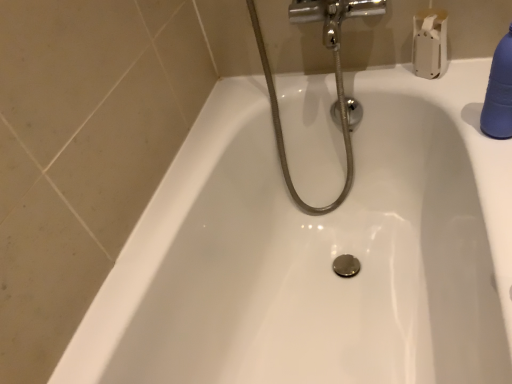
Locate an element on the screen. This screenshot has width=512, height=384. blue rubber bottle at upper right is located at coordinates (499, 92).

I want to click on chrome metallic showerhead at upper center, so click(335, 75).

Can you see blue rubber bottle at upper right touching white matte toilet paper at upper right?

No, blue rubber bottle at upper right is not next to white matte toilet paper at upper right.

Is the depth of blue rubber bottle at upper right greater than that of white matte toilet paper at upper right?

No, blue rubber bottle at upper right is closer to the viewer.

Can you confirm if blue rubber bottle at upper right is bigger than white matte toilet paper at upper right?

Actually, blue rubber bottle at upper right might be smaller than white matte toilet paper at upper right.

Is blue rubber bottle at upper right to the right of white matte toilet paper at upper right from the viewer's perspective?

Indeed, blue rubber bottle at upper right is positioned on the right side of white matte toilet paper at upper right.

Which is behind, white matte toilet paper at upper right or blue rubber bottle at upper right?

Positioned behind is white matte toilet paper at upper right.

Visually, is white matte toilet paper at upper right positioned to the left or to the right of blue rubber bottle at upper right?

white matte toilet paper at upper right is positioned on blue rubber bottle at upper right's left side.

Between white matte toilet paper at upper right and blue rubber bottle at upper right, which one has smaller width?

Thinner between the two is blue rubber bottle at upper right.

Are white matte toilet paper at upper right and blue rubber bottle at upper right located far from each other?

No.

From a real-world perspective, is chrome metallic showerhead at upper center on blue rubber bottle at upper right?

No, from a real-world perspective, chrome metallic showerhead at upper center is not above blue rubber bottle at upper right.

Would you say chrome metallic showerhead at upper center is inside or outside blue rubber bottle at upper right?

chrome metallic showerhead at upper center is not enclosed by blue rubber bottle at upper right.

Considering the relative positions of chrome metallic showerhead at upper center and blue rubber bottle at upper right in the image provided, is chrome metallic showerhead at upper center to the left or to the right of blue rubber bottle at upper right?

Clearly, chrome metallic showerhead at upper center is on the left of blue rubber bottle at upper right in the image.

Considering the sizes of chrome metallic showerhead at upper center and blue rubber bottle at upper right in the image, is chrome metallic showerhead at upper center wider or thinner than blue rubber bottle at upper right?

chrome metallic showerhead at upper center is wider than blue rubber bottle at upper right.

From the image's perspective, does white matte toilet paper at upper right appear higher than chrome metallic showerhead at upper center?

Yes.

How much distance is there between white matte toilet paper at upper right and chrome metallic showerhead at upper center?

The distance of white matte toilet paper at upper right from chrome metallic showerhead at upper center is 9.16 inches.

Can you confirm if white matte toilet paper at upper right is bigger than chrome metallic showerhead at upper center?

Incorrect, white matte toilet paper at upper right is not larger than chrome metallic showerhead at upper center.

Considering the relative sizes of blue rubber bottle at upper right and chrome metallic showerhead at upper center in the image provided, is blue rubber bottle at upper right thinner than chrome metallic showerhead at upper center?

Indeed, blue rubber bottle at upper right has a lesser width compared to chrome metallic showerhead at upper center.

Would you consider blue rubber bottle at upper right to be distant from chrome metallic showerhead at upper center?

No, there isn't a large distance between blue rubber bottle at upper right and chrome metallic showerhead at upper center.

In the image, is blue rubber bottle at upper right positioned in front of or behind chrome metallic showerhead at upper center?

blue rubber bottle at upper right is positioned closer to the viewer than chrome metallic showerhead at upper center.

Is chrome metallic showerhead at upper center located outside white matte toilet paper at upper right?

chrome metallic showerhead at upper center is positioned outside white matte toilet paper at upper right.

Is chrome metallic showerhead at upper center directly adjacent to white matte toilet paper at upper right?

They are not placed beside each other.

The image size is (512, 384). Find the location of `plumbing fixture that appears below the white matte toilet paper at upper right (from the image's perspective)`. plumbing fixture that appears below the white matte toilet paper at upper right (from the image's perspective) is located at coordinates (335, 75).

The height and width of the screenshot is (384, 512). Identify the location of cleaning product in front of the white matte toilet paper at upper right. (499, 92).

Where is `cleaning product that is above the white matte toilet paper at upper right (from a real-world perspective)`? cleaning product that is above the white matte toilet paper at upper right (from a real-world perspective) is located at coordinates (499, 92).

From the image, which object appears to be nearer to blue rubber bottle at upper right, white matte toilet paper at upper right or chrome metallic showerhead at upper center?

white matte toilet paper at upper right is positioned closer to the anchor blue rubber bottle at upper right.

Estimate the real-world distances between objects in this image. Which object is further from white matte toilet paper at upper right, blue rubber bottle at upper right or chrome metallic showerhead at upper center?

Based on the image, blue rubber bottle at upper right appears to be further to white matte toilet paper at upper right.

Looking at the image, which one is located further to chrome metallic showerhead at upper center, white matte toilet paper at upper right or blue rubber bottle at upper right?

blue rubber bottle at upper right lies further to chrome metallic showerhead at upper center than the other object.

From the image, which object appears to be farther from chrome metallic showerhead at upper center, blue rubber bottle at upper right or white matte toilet paper at upper right?

blue rubber bottle at upper right is further to chrome metallic showerhead at upper center.

Considering their positions, is chrome metallic showerhead at upper center positioned further to blue rubber bottle at upper right than white matte toilet paper at upper right?

Based on the image, chrome metallic showerhead at upper center appears to be further to blue rubber bottle at upper right.

Which object lies further to the anchor point white matte toilet paper at upper right, chrome metallic showerhead at upper center or blue rubber bottle at upper right?

blue rubber bottle at upper right lies further to white matte toilet paper at upper right than the other object.

Locate an element on the screen. toilet paper between chrome metallic showerhead at upper center and blue rubber bottle at upper right is located at coordinates (430, 43).